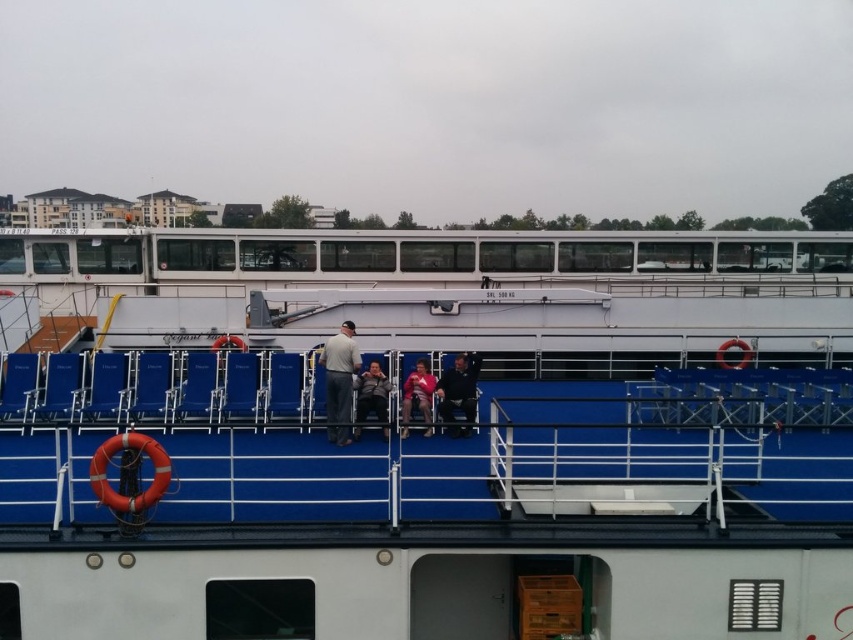
You are a passenger on the cruise ship and want to sit down on the blue plastic chairs at center. However, you notice a dark gray fabric jacket at center nearby. Is the jacket placed on top of the chairs or under them?

The blue plastic chairs at center is above dark gray fabric jacket at center, so the jacket is placed under the chairs.

You are a passenger on the cruise ship and want to locate your two jackets. You remember that the dark gray fabric jacket at center is to the right of the matte black jacket at center. If you are facing the jackets from the front of the deck, which jacket is closer to your left side?

The matte black jacket at center is closer to your left side because the dark gray fabric jacket at center is positioned to its right, meaning the matte black jacket is on the left when viewed from the front of the deck.